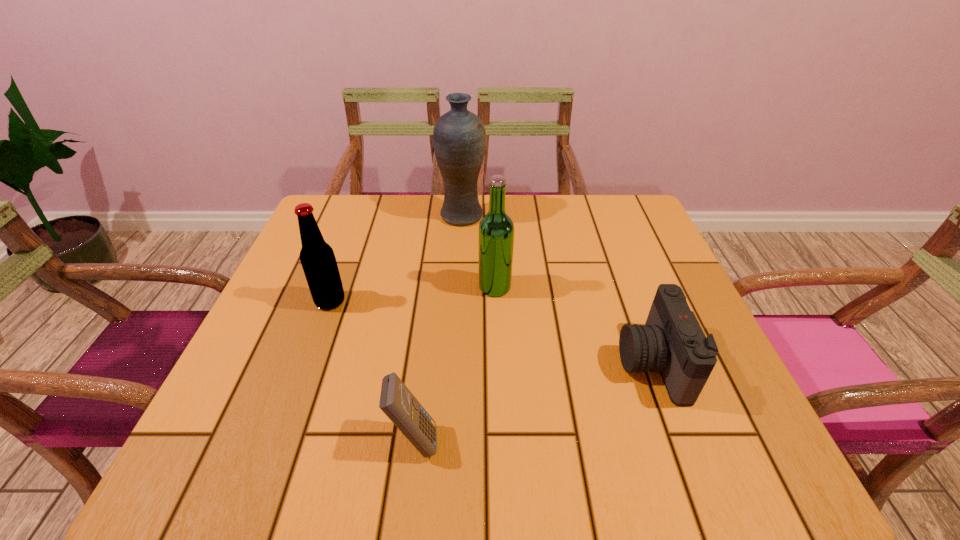
Find the location of a particular element. free space at the left edge of the desktop is located at coordinates (236, 374).

The height and width of the screenshot is (540, 960). Identify the location of vacant space at the right edge of the desktop. (686, 411).

The height and width of the screenshot is (540, 960). In the image, there is a desktop. Identify the location of vacant space at the far left corner. (336, 210).

Identify the location of vacant space at the near left corner of the desktop. This screenshot has height=540, width=960. (257, 479).

Where is `free point at the far right corner`? The image size is (960, 540). free point at the far right corner is located at coordinates (633, 195).

In order to click on free area in between the tallest object and the leftmost object in this screenshot , I will do [396, 259].

This screenshot has height=540, width=960. Identify the location of vacant space that's between the second nearest object and the farthest object. (557, 289).

Find the location of a particular element. The width and height of the screenshot is (960, 540). vacant region between the calculator and the leftmost object is located at coordinates (372, 370).

I want to click on vacant area that lies between the right beer bottle and the second nearest object, so pos(573,325).

This screenshot has width=960, height=540. Identify the location of free space between the tallest object and the leftmost object. (396, 259).